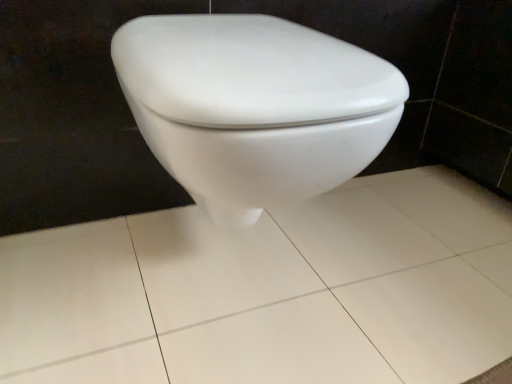
This screenshot has width=512, height=384. Find the location of `free point above white glossy toilet at center (from a real-world perspective)`. free point above white glossy toilet at center (from a real-world perspective) is located at coordinates (291, 274).